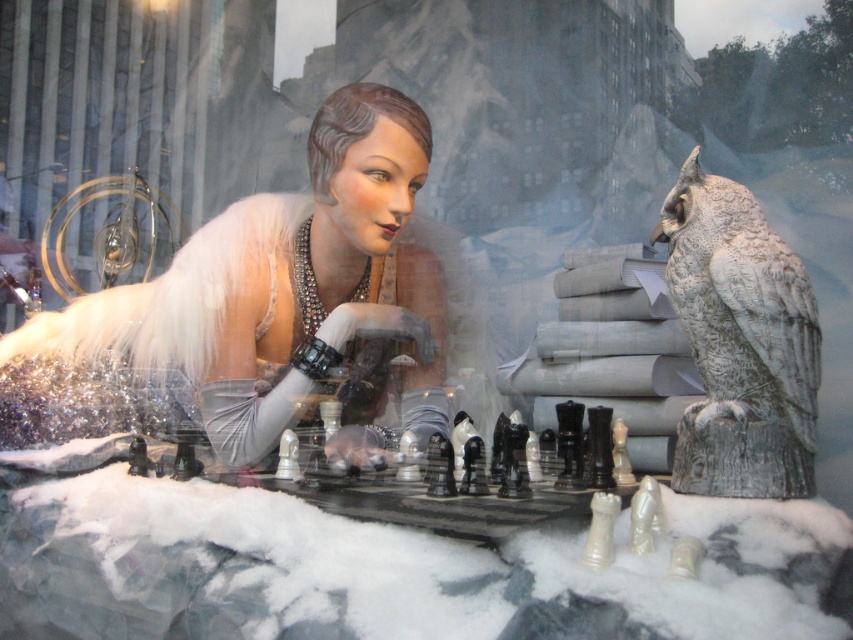
You are a customer looking at the store window display. You see the mannequin with a shiny silver dress at center and notice a point marked at coordinates (265, 310). Where is this point located in relation to the shiny silver dress at center?

The point at coordinates (265, 310) corresponds to the shiny silver dress at center, so it is located exactly on the dress.

You are standing in front of the store window display and want to touch both points marked in the image. Which point, point 1 at coordinates (68,435) or point 2 at coordinates (807,392), would you reach first?

Point 1 at coordinates (68,435) is closer to you than point 2 at coordinates (807,392), so you would reach point 1 first.

You are a customer in the store and want to know if the shiny silver dress at center is placed higher or lower than the gray stone owl at upper right. According to the scene, what can you observe?

The shiny silver dress at center is below the gray stone owl at upper right.